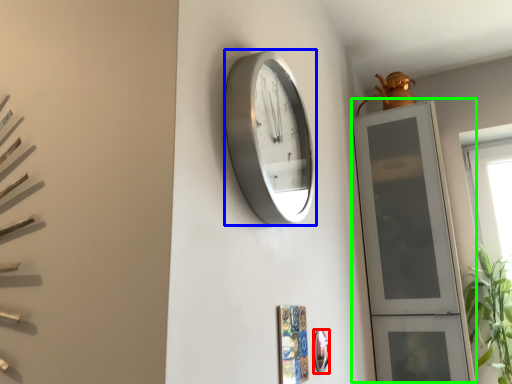
Question: Estimate the real-world distances between objects in this image. Which object is closer to mirror (highlighted by a red box), wall clock (highlighted by a blue box) or glass door (highlighted by a green box)?

Choices:
 (A) wall clock
 (B) glass door

Answer: (A)